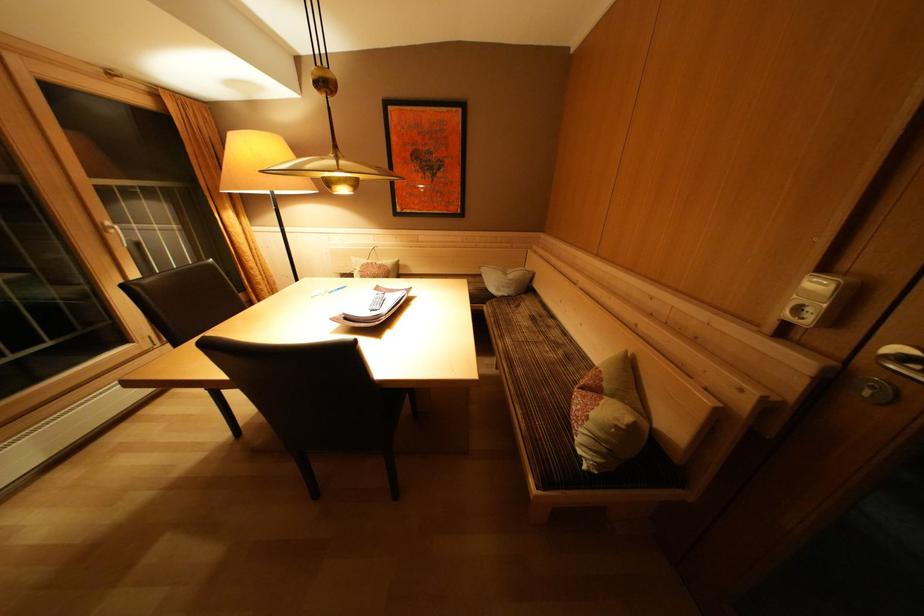
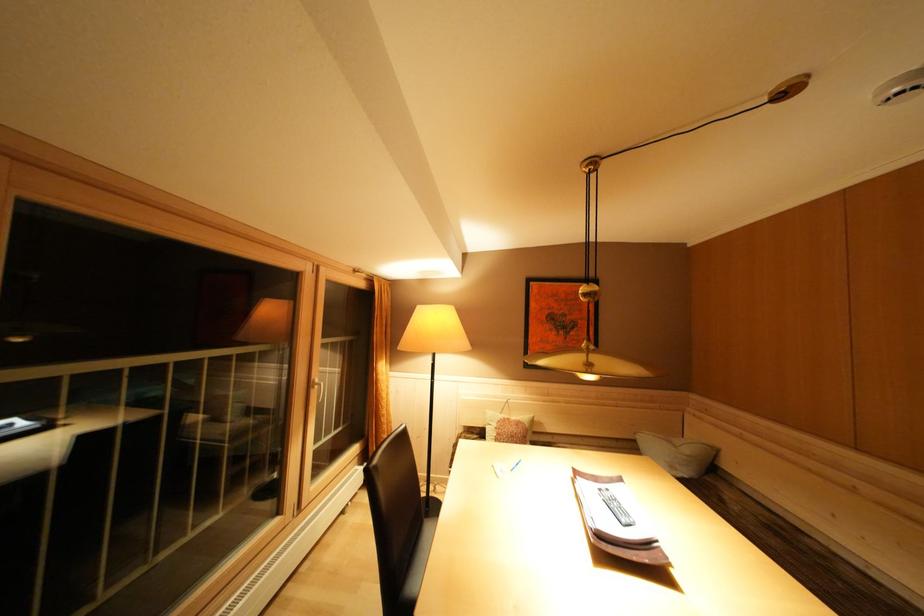
In the second image, find the point that corresponds to pixel 148 290 in the first image.

(383, 472)